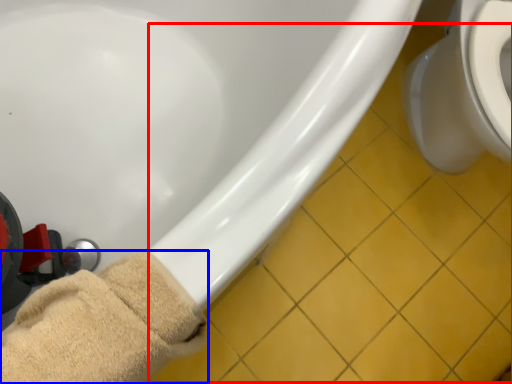
Question: Which object appears closest to the camera in this image, tile (highlighted by a red box) or towel (highlighted by a blue box)?

Choices:
 (A) tile
 (B) towel

Answer: (B)